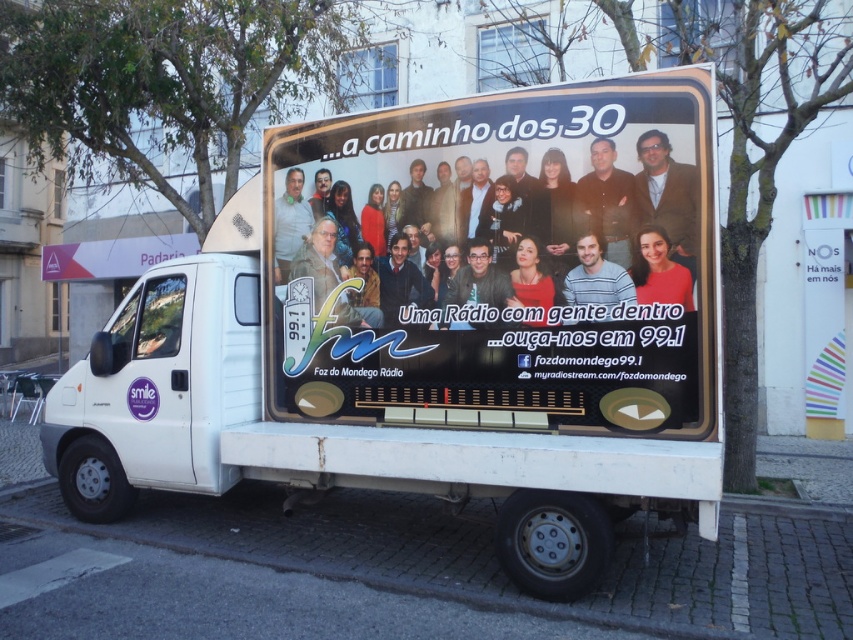
You are a photographer standing in front of the white van with a camera. You want to take a clear photo of the smooth skin face at center. What is the minimum distance you need to be from the van to ensure the face is in focus?

The smooth skin face at center is 4.35 meters away from the camera. To ensure the face is in focus, you need to be at least 4.35 meters away from the van.

You are a photographer trying to capture a clear photo of the dark gray shirt at center and the matte black face at center on the van advertisement. Given that your camera has a depth of field that can sharply focus on objects within a 7 inch range, will both objects be in focus?

The dark gray shirt at center is 7.32 inches from the matte black face at center. Since the distance between them is slightly beyond the 7 inch depth of field range, the two objects might not both be in focus simultaneously.

You are a photographer holding a camera with a 24 inch lens. You are standing in front of the white van and want to take a photo of the smooth skin face at center and the matte red shirt at center. Can the lens capture both subjects in the same frame without moving the camera?

The distance between the smooth skin face at center and the matte red shirt at center is 25.01 inches. Since the camera lens is 24 inches, the subjects are slightly further apart than the lens can capture in one frame without moving the camera.